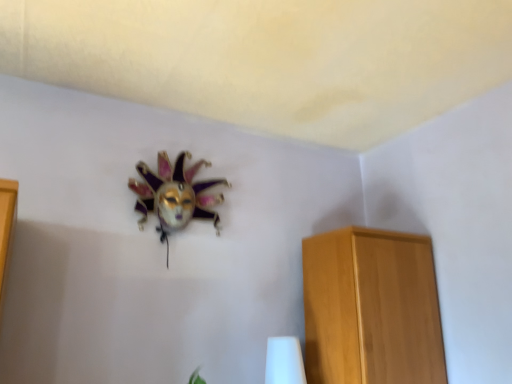
Question: From the image's perspective, is metallic mask at upper center positioned above or below light brown wooden cabinet at right?

Choices:
 (A) below
 (B) above

Answer: (B)

Question: From a real-world perspective, relative to light brown wooden cabinet at right, is metallic mask at upper center vertically above or below?

Choices:
 (A) above
 (B) below

Answer: (A)

Question: Which of these objects is positioned farthest from the light brown wooden cabinet at right?

Choices:
 (A) white glossy table lamp at lower center
 (B) metallic mask at upper center

Answer: (B)

Question: Which of these objects is positioned closest to the white glossy table lamp at lower center?

Choices:
 (A) metallic mask at upper center
 (B) light brown wooden cabinet at right

Answer: (B)